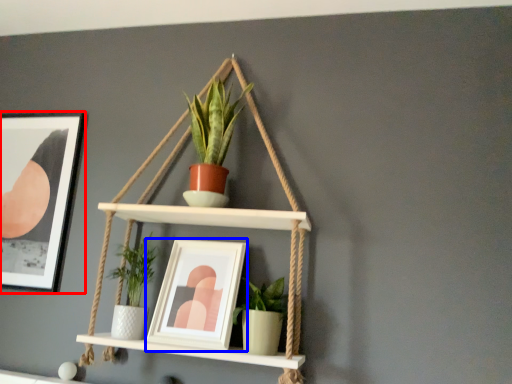
Question: Which object is closer to the camera taking this photo, picture frame (highlighted by a red box) or picture frame (highlighted by a blue box)?

Choices:
 (A) picture frame
 (B) picture frame

Answer: (B)